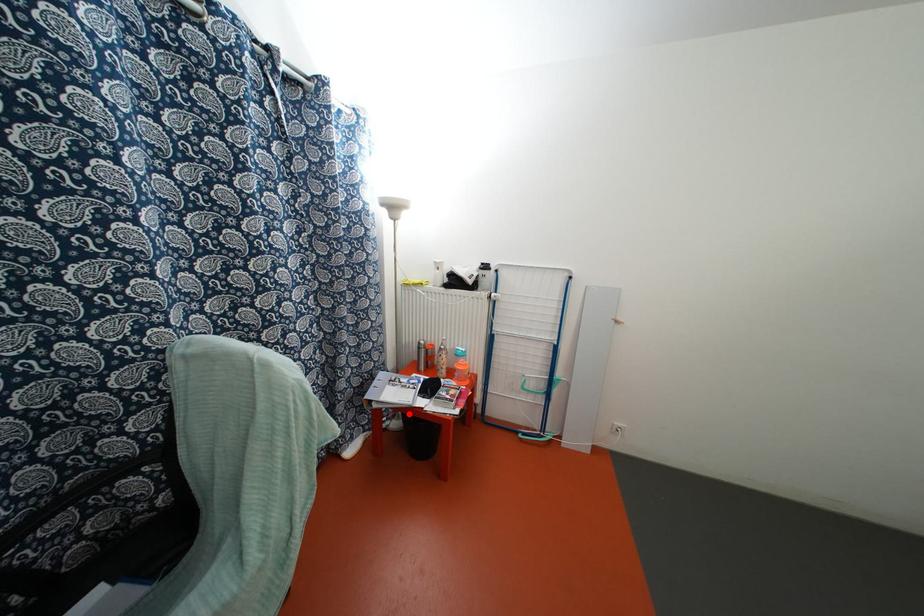
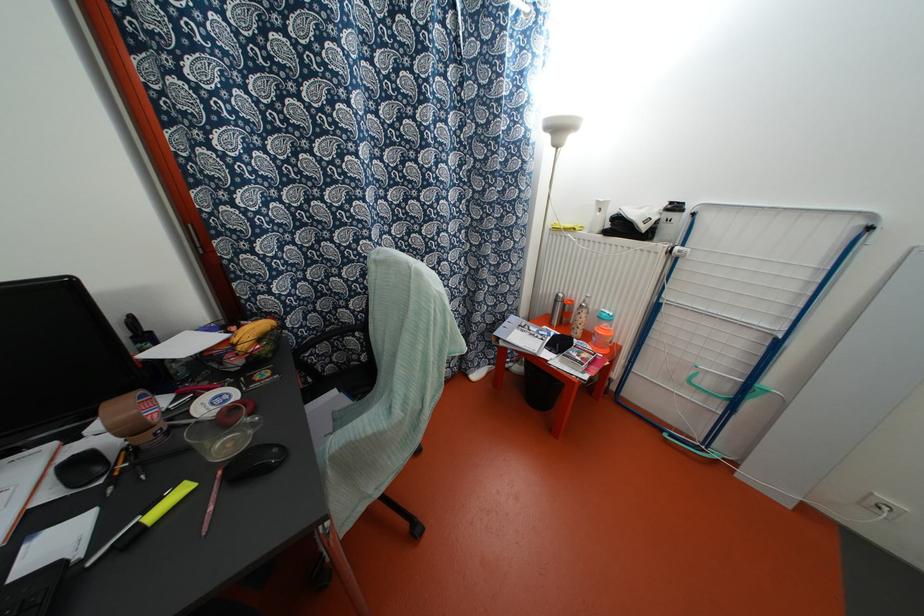
The point at the highlighted location is marked in the first image. Where is the corresponding point in the second image?

(531, 362)